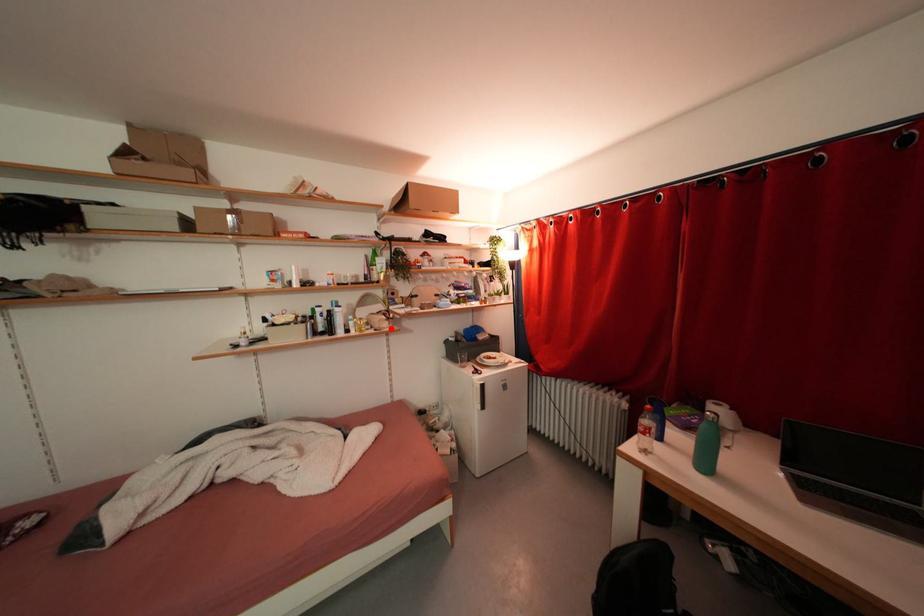
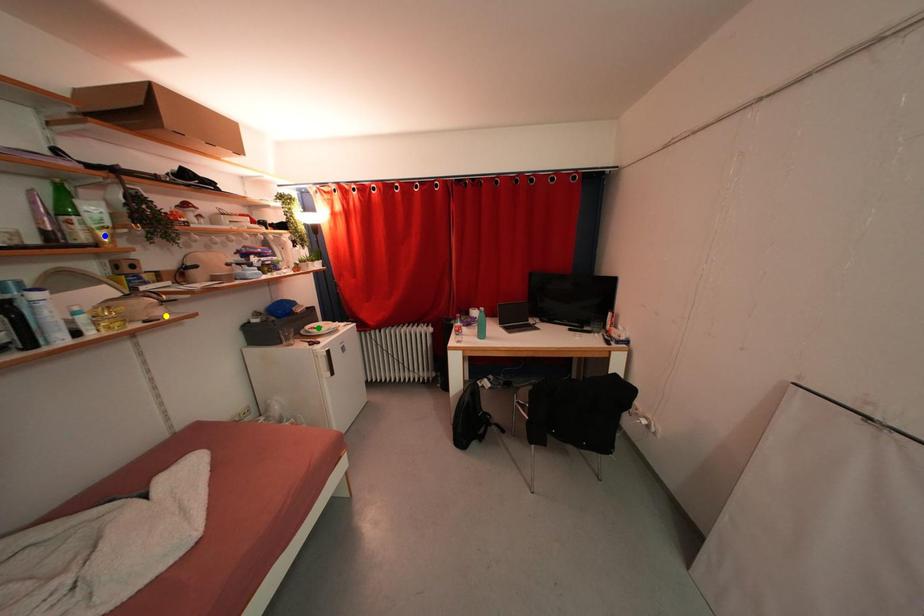
Question: I am providing you with two images of the same scene from different viewpoints. A red point is marked on the first image. You are given multiple points on the second image. Which point in image 2 is actually the same real-world point as the red point in image 1?

Choices:
 (A) yellow point
 (B) green point
 (C) blue point

Answer: (A)